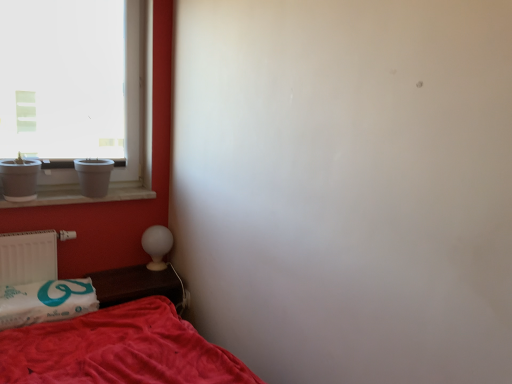
Question: Is white glossy table lamp at lower left not close to white matte radiator at lower left?

Choices:
 (A) no
 (B) yes

Answer: (A)

Question: Does white glossy table lamp at lower left have a larger size compared to white matte radiator at lower left?

Choices:
 (A) no
 (B) yes

Answer: (A)

Question: Are white glossy table lamp at lower left and white matte radiator at lower left beside each other?

Choices:
 (A) no
 (B) yes

Answer: (A)

Question: Can you confirm if white glossy table lamp at lower left is positioned to the left of white matte radiator at lower left?

Choices:
 (A) yes
 (B) no

Answer: (B)

Question: From a real-world perspective, does white glossy table lamp at lower left sit lower than white matte radiator at lower left?

Choices:
 (A) no
 (B) yes

Answer: (B)

Question: Is white marble window sill at left inside or outside of white matte window at upper left?

Choices:
 (A) outside
 (B) inside

Answer: (A)

Question: Is white marble window sill at left to the left or to the right of white matte window at upper left in the image?

Choices:
 (A) left
 (B) right

Answer: (B)

Question: From their relative heights in the image, would you say white marble window sill at left is taller or shorter than white matte window at upper left?

Choices:
 (A) short
 (B) tall

Answer: (A)

Question: From the image's perspective, is white marble window sill at left located above or below white matte window at upper left?

Choices:
 (A) above
 (B) below

Answer: (B)

Question: Considering their positions, is white matte radiator at lower left located in front of or behind white glossy table lamp at lower left?

Choices:
 (A) behind
 (B) front

Answer: (B)

Question: Considering the positions of white matte radiator at lower left and white glossy table lamp at lower left in the image, is white matte radiator at lower left wider or thinner than white glossy table lamp at lower left?

Choices:
 (A) thin
 (B) wide

Answer: (A)

Question: Based on their sizes in the image, would you say white matte radiator at lower left is bigger or smaller than white glossy table lamp at lower left?

Choices:
 (A) big
 (B) small

Answer: (A)

Question: From a real-world perspective, is white matte radiator at lower left above or below white glossy table lamp at lower left?

Choices:
 (A) above
 (B) below

Answer: (A)

Question: Is point (x=163, y=231) positioned closer to the camera than point (x=150, y=144)?

Choices:
 (A) farther
 (B) closer

Answer: (B)

Question: In terms of size, does white glossy table lamp at lower left appear bigger or smaller than white matte window at upper left?

Choices:
 (A) small
 (B) big

Answer: (A)